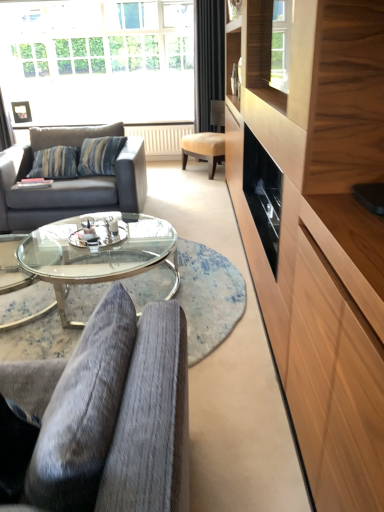
Question: Is point (340, 458) positioned closer to the camera than point (122, 180)?

Choices:
 (A) farther
 (B) closer

Answer: (B)

Question: Is wooden cabinet at right inside or outside of gray fabric couch at left?

Choices:
 (A) outside
 (B) inside

Answer: (A)

Question: Which object is positioned closest to the transparent glass coffee table at center?

Choices:
 (A) black velvet curtain at upper center
 (B) transparent glass window at upper center
 (C) wooden cabinet at right
 (D) velvet grey armchair at center, which appears as the second chair when viewed from the back
 (E) gray fabric couch at left

Answer: (E)

Question: Which is farther from the transparent glass window at upper center?

Choices:
 (A) transparent glass coffee table at center
 (B) black velvet curtain at upper center
 (C) wooden cabinet at right
 (D) beige leather chair at center, the first chair positioned from the back
 (E) velvet grey armchair at center, the 1th chair viewed from the front

Answer: (E)